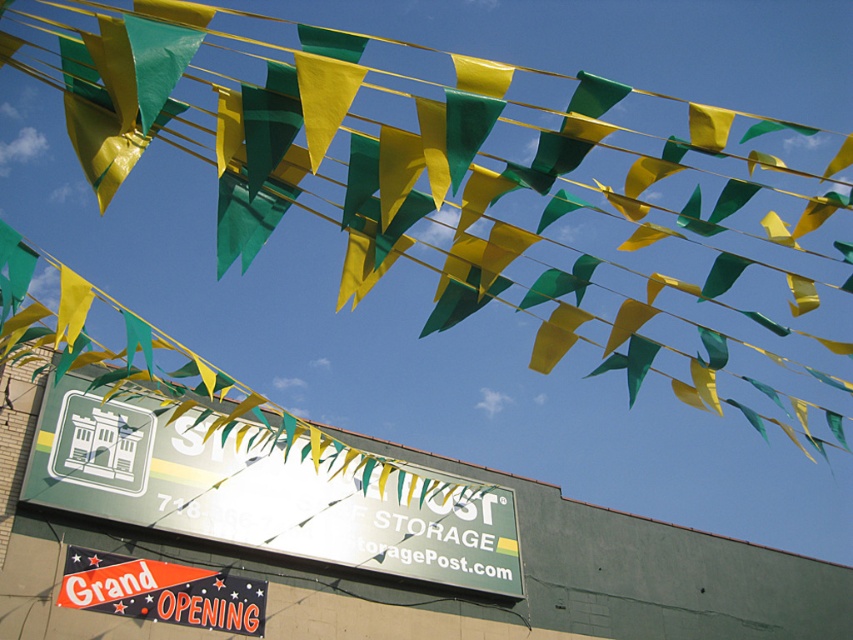
Question: Which point is farther from the camera taking this photo?

Choices:
 (A) (347, 563)
 (B) (113, 145)

Answer: (A)

Question: Which of the following is the farthest from the observer?

Choices:
 (A) (x=126, y=496)
 (B) (x=521, y=144)

Answer: (B)

Question: Does green fabric flag at upper center have a larger size compared to green matte signboard at center?

Choices:
 (A) no
 (B) yes

Answer: (B)

Question: Which object is farther from the camera taking this photo?

Choices:
 (A) green matte signboard at center
 (B) green fabric flag at upper center

Answer: (A)

Question: From the image, what is the correct spatial relationship of green fabric flag at upper center in relation to green matte signboard at center?

Choices:
 (A) below
 (B) above

Answer: (B)

Question: Is green fabric flag at upper center closer to the viewer compared to green matte signboard at center?

Choices:
 (A) no
 (B) yes

Answer: (B)